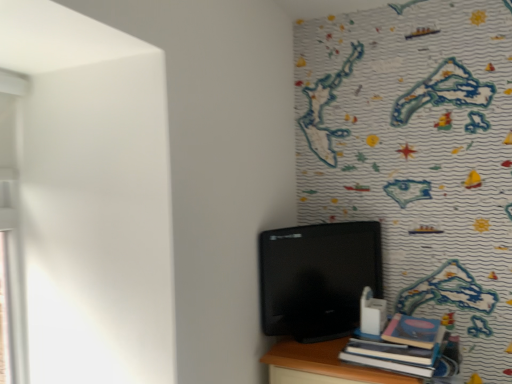
Question: Is hardcover book at lower right inside or outside of black glossy monitor at center?

Choices:
 (A) inside
 (B) outside

Answer: (B)

Question: Is hardcover book at lower right in front of or behind black glossy monitor at center in the image?

Choices:
 (A) front
 (B) behind

Answer: (A)

Question: Would you say hardcover book at lower right is to the left or to the right of black glossy monitor at center in the picture?

Choices:
 (A) right
 (B) left

Answer: (A)

Question: Choose the correct answer: Is black glossy monitor at center inside hardcover book at lower right or outside it?

Choices:
 (A) outside
 (B) inside

Answer: (A)

Question: Does point (355, 278) appear closer or farther from the camera than point (398, 324)?

Choices:
 (A) closer
 (B) farther

Answer: (B)

Question: From a real-world perspective, is black glossy monitor at center positioned above or below hardcover book at lower right?

Choices:
 (A) below
 (B) above

Answer: (B)

Question: Based on their sizes in the image, would you say black glossy monitor at center is bigger or smaller than hardcover book at lower right?

Choices:
 (A) big
 (B) small

Answer: (A)